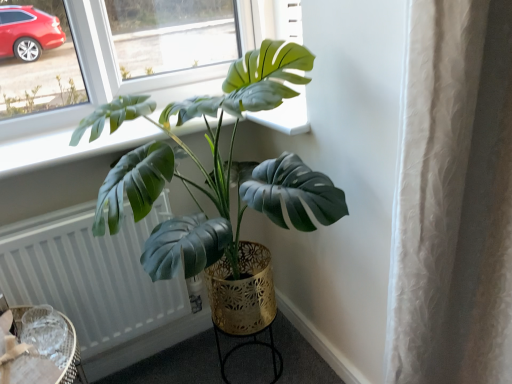
Question: Is white textured radiator at lower left at the right side of green matte plant at center?

Choices:
 (A) no
 (B) yes

Answer: (A)

Question: Would you say white textured radiator at lower left is outside green matte plant at center?

Choices:
 (A) yes
 (B) no

Answer: (B)

Question: Does white textured radiator at lower left have a smaller size compared to green matte plant at center?

Choices:
 (A) yes
 (B) no

Answer: (A)

Question: Is white textured radiator at lower left with green matte plant at center?

Choices:
 (A) yes
 (B) no

Answer: (B)

Question: Can you confirm if white textured radiator at lower left is positioned to the left of green matte plant at center?

Choices:
 (A) no
 (B) yes

Answer: (B)

Question: Considering the relative sizes of white textured radiator at lower left and green matte plant at center in the image provided, is white textured radiator at lower left bigger than green matte plant at center?

Choices:
 (A) yes
 (B) no

Answer: (B)

Question: Can we say green matte plant at center lies outside woven rattan table at lower left, acting as the second round table starting from the right?

Choices:
 (A) yes
 (B) no

Answer: (A)

Question: From a real-world perspective, does green matte plant at center sit lower than woven rattan table at lower left, placed as the 2th round table when sorted from back to front?

Choices:
 (A) no
 (B) yes

Answer: (A)

Question: Considering the relative sizes of green matte plant at center and woven rattan table at lower left, which is counted as the first round table, starting from the front, in the image provided, is green matte plant at center taller than woven rattan table at lower left, which is counted as the first round table, starting from the front,?

Choices:
 (A) no
 (B) yes

Answer: (B)

Question: Is green matte plant at center turned away from woven rattan table at lower left, the first round table viewed from the left?

Choices:
 (A) no
 (B) yes

Answer: (A)

Question: Does green matte plant at center come behind woven rattan table at lower left, acting as the second round table starting from the right?

Choices:
 (A) no
 (B) yes

Answer: (A)

Question: Considering the relative sizes of green matte plant at center and woven rattan table at lower left, the first round table viewed from the left, in the image provided, is green matte plant at center bigger than woven rattan table at lower left, the first round table viewed from the left,?

Choices:
 (A) no
 (B) yes

Answer: (B)

Question: From a real-world perspective, is green matte plant at center beneath gold metallic round table at lower center, marked as the first round table in a back-to-front arrangement?

Choices:
 (A) no
 (B) yes

Answer: (A)